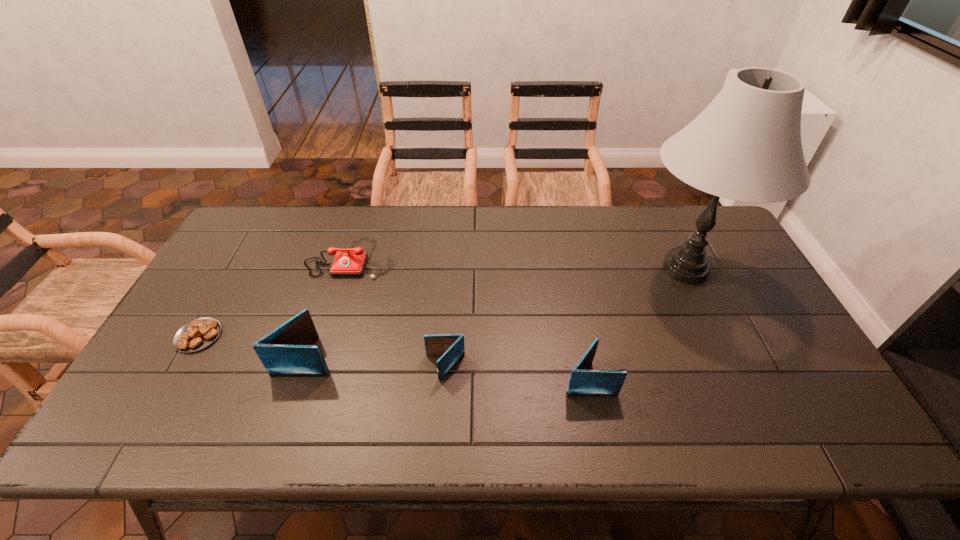
Locate an element on the screen. Image resolution: width=960 pixels, height=540 pixels. the leftmost wallet is located at coordinates (288, 351).

Locate an element on the screen. The height and width of the screenshot is (540, 960). the tallest wallet is located at coordinates (288, 351).

Where is `the shortest wallet`? the shortest wallet is located at coordinates (451, 346).

Locate an element on the screen. Image resolution: width=960 pixels, height=540 pixels. the third object from right to left is located at coordinates (451, 346).

This screenshot has width=960, height=540. In order to click on the second tallest wallet in this screenshot , I will do `click(583, 382)`.

I want to click on the third tallest object, so [583, 382].

Where is `telephone`? telephone is located at coordinates pyautogui.click(x=351, y=262).

Where is `lamp`? This screenshot has width=960, height=540. lamp is located at coordinates (746, 146).

The width and height of the screenshot is (960, 540). I want to click on the rightmost object, so click(x=746, y=146).

What are the coordinates of `the leftmost object` in the screenshot? It's located at (199, 333).